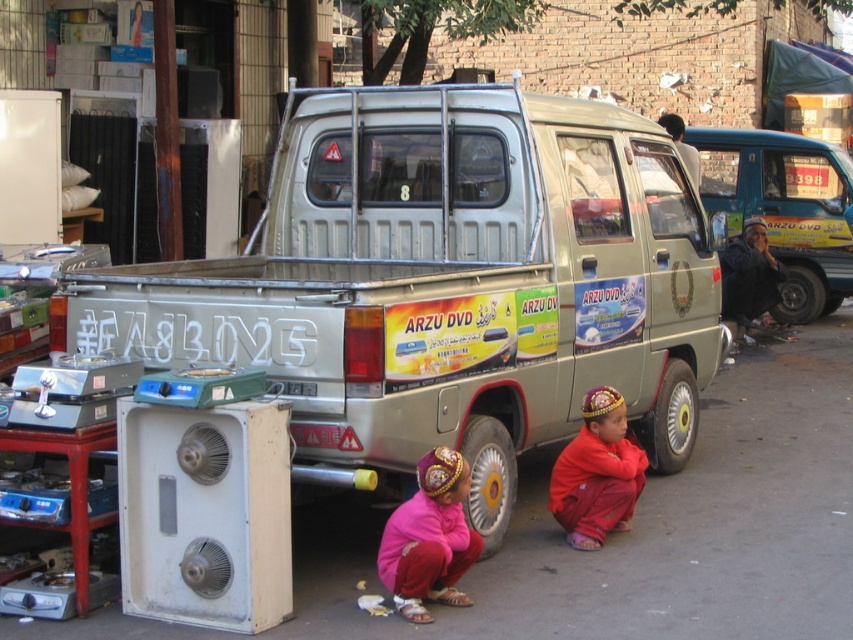
You are a delivery person trying to park your metallic silver van at right in a narrow alley. There is a white metallic tire at lower center in the way. Can you safely maneuver your van around the tire without hitting it?

The metallic silver van at right is positioned over white metallic tire at lower center, meaning the van is already placed on top of the tire. Since the van is already over the tire, it is not possible to maneuver around it without moving the tire first.

You are a delivery person who needs to place a package between the pink fabric pants at lower center and the white metallic tire at lower center. The package requires a minimum of 50 centimeters of space. Can you fit it there?

The distance between the pink fabric pants at lower center and the white metallic tire at lower center is 52.92 centimeters, which is more than the required 50 centimeters. Therefore, the package can be placed there.

You are a delivery driver who needs to park your vehicle between the metallic silver van at right and the white metallic tire at lower center. Can your 2.5 meter wide truck fit in the space between them?

The metallic silver van at right is wider than the white metallic tire at lower center. However, since the exact distance between them isn t provided, we can t determine if your 2.5 meter wide truck will fit. Please measure the actual space available.